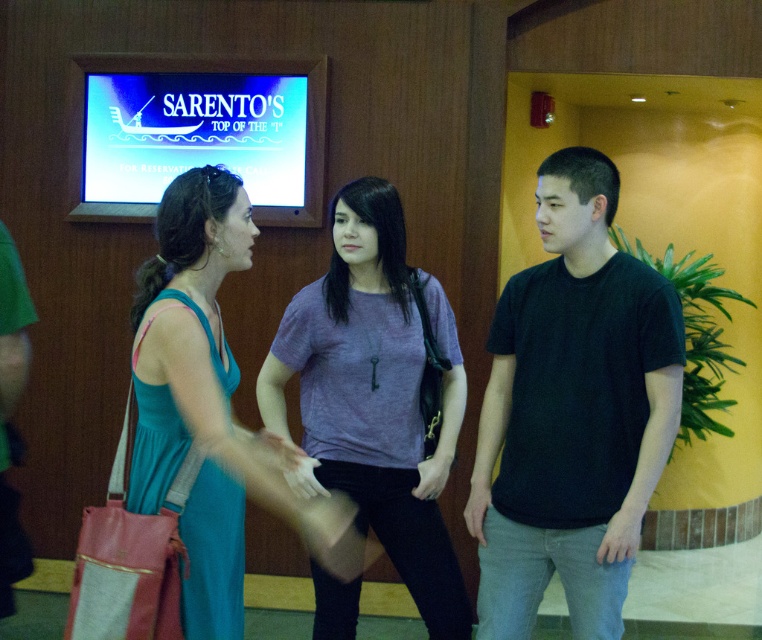
What is the location of the point with coordinates (572, 412) in the image?

The point with coordinates (572, 412) is located on the black matte t shirt at center.